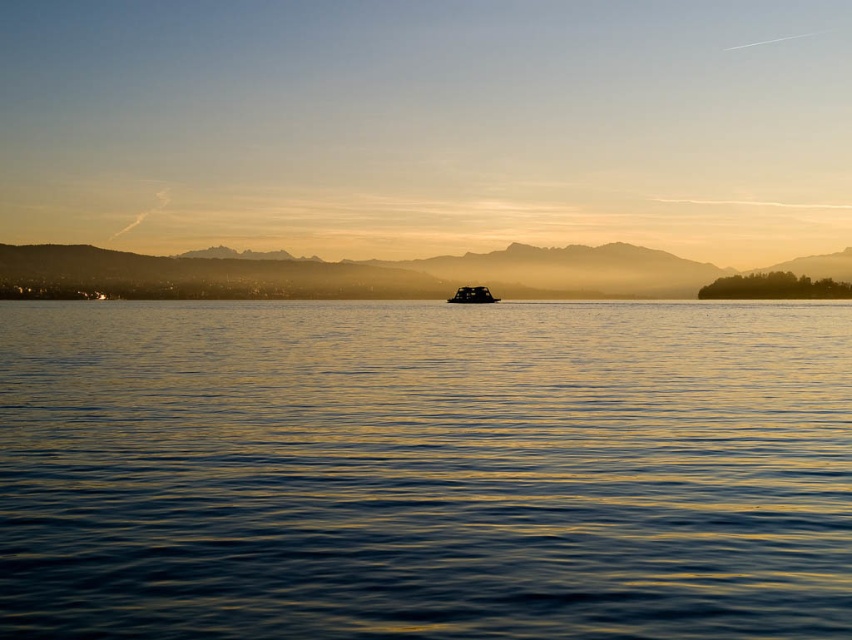
You are standing on the lakeshore and see the silvery metallic mountain at center and the black rubber boat at center. Which object is higher from your viewpoint?

The silvery metallic mountain at center is above the black rubber boat at center, so it is higher from your viewpoint.